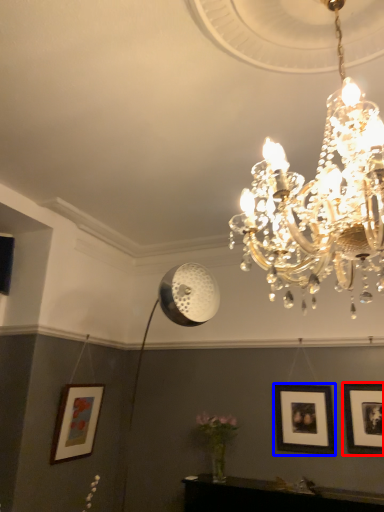
Question: Among these objects, which one is farthest to the camera, picture frame (highlighted by a red box) or picture frame (highlighted by a blue box)?

Choices:
 (A) picture frame
 (B) picture frame

Answer: (B)